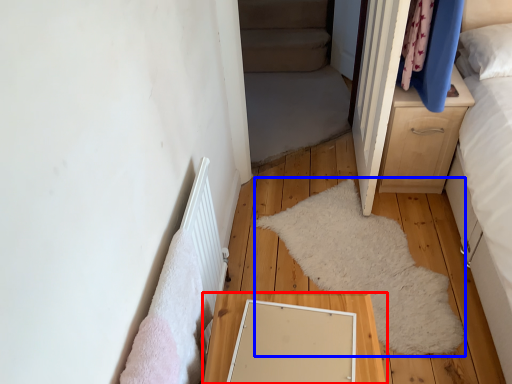
Question: Which point is closer to the camera, table (highlighted by a red box) or mat (highlighted by a blue box)?

Choices:
 (A) table
 (B) mat

Answer: (A)